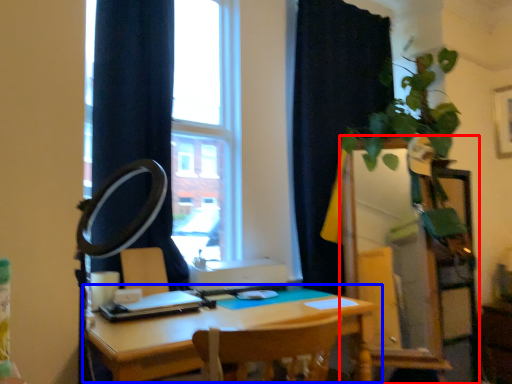
Question: Which of the following is the farthest to the observer, dresser (highlighted by a red box) or table (highlighted by a blue box)?

Choices:
 (A) dresser
 (B) table

Answer: (A)